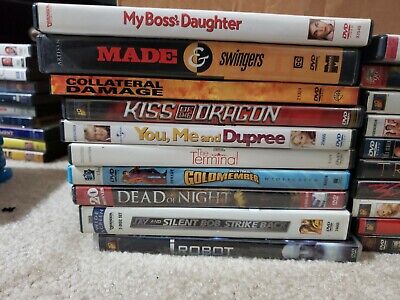
Image resolution: width=400 pixels, height=300 pixels. Identify the location of white dvd case spines. (24, 48), (14, 62), (9, 74), (88, 19), (123, 133), (132, 158), (127, 216), (372, 212), (379, 125), (390, 103).